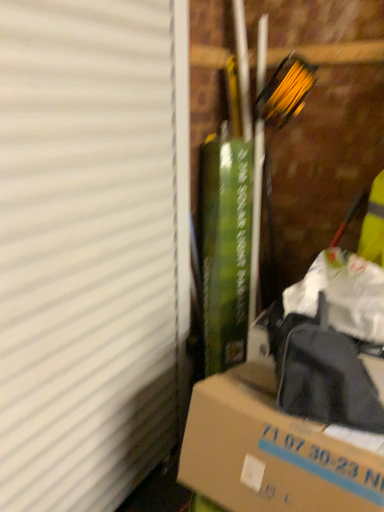
Question: From their relative heights in the image, would you say brown cardboard box at lower right is taller or shorter than white matte window screen at left?

Choices:
 (A) short
 (B) tall

Answer: (A)

Question: Considering the relative positions of brown cardboard box at lower right and white matte window screen at left in the image provided, is brown cardboard box at lower right to the left or to the right of white matte window screen at left?

Choices:
 (A) left
 (B) right

Answer: (B)

Question: Relative to white matte window screen at left, is brown cardboard box at lower right in front or behind?

Choices:
 (A) behind
 (B) front

Answer: (A)

Question: Considering the positions of white matte window screen at left and brown cardboard box at lower right in the image, is white matte window screen at left wider or thinner than brown cardboard box at lower right?

Choices:
 (A) thin
 (B) wide

Answer: (A)

Question: Is point (69, 434) closer or farther from the camera than point (206, 399)?

Choices:
 (A) farther
 (B) closer

Answer: (A)

Question: Is white matte window screen at left inside or outside of brown cardboard box at lower right?

Choices:
 (A) outside
 (B) inside

Answer: (A)

Question: Is white matte window screen at left taller or shorter than brown cardboard box at lower right?

Choices:
 (A) short
 (B) tall

Answer: (B)